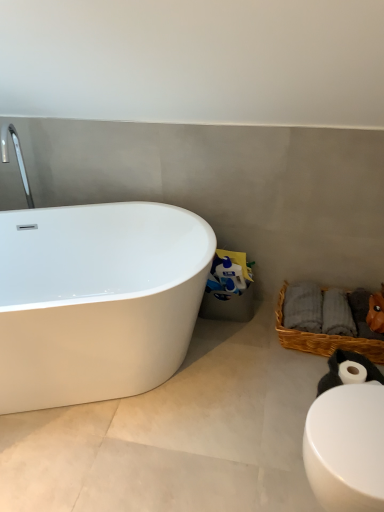
Question: Is woven brown basket at lower right closer to the viewer compared to white matte toilet paper roll at lower right?

Choices:
 (A) no
 (B) yes

Answer: (A)

Question: From the image's perspective, is woven brown basket at lower right beneath white matte toilet paper roll at lower right?

Choices:
 (A) yes
 (B) no

Answer: (B)

Question: From a real-world perspective, is woven brown basket at lower right under white matte toilet paper roll at lower right?

Choices:
 (A) yes
 (B) no

Answer: (A)

Question: Considering the relative sizes of woven brown basket at lower right and white matte toilet paper roll at lower right in the image provided, is woven brown basket at lower right taller than white matte toilet paper roll at lower right?

Choices:
 (A) no
 (B) yes

Answer: (B)

Question: Does woven brown basket at lower right appear on the left side of white matte toilet paper roll at lower right?

Choices:
 (A) no
 (B) yes

Answer: (A)

Question: Is white matte toilet paper roll at lower right a part of woven brown basket at lower right?

Choices:
 (A) yes
 (B) no

Answer: (B)

Question: Is white glossy toilet at lower right looking in the opposite direction of white glossy bathtub at left?

Choices:
 (A) yes
 (B) no

Answer: (B)

Question: Can you confirm if white glossy toilet at lower right is wider than white glossy bathtub at left?

Choices:
 (A) yes
 (B) no

Answer: (B)

Question: Is white glossy toilet at lower right next to white glossy bathtub at left?

Choices:
 (A) yes
 (B) no

Answer: (B)

Question: Considering the relative positions of white glossy toilet at lower right and white glossy bathtub at left in the image provided, is white glossy toilet at lower right to the left of white glossy bathtub at left from the viewer's perspective?

Choices:
 (A) yes
 (B) no

Answer: (B)

Question: Considering the relative sizes of white glossy toilet at lower right and white glossy bathtub at left in the image provided, is white glossy toilet at lower right taller than white glossy bathtub at left?

Choices:
 (A) yes
 (B) no

Answer: (A)

Question: Is white glossy toilet at lower right at the right side of white glossy bathtub at left?

Choices:
 (A) yes
 (B) no

Answer: (A)

Question: Does white glossy bathtub at left have a lesser height compared to white matte toilet paper roll at lower right?

Choices:
 (A) no
 (B) yes

Answer: (A)